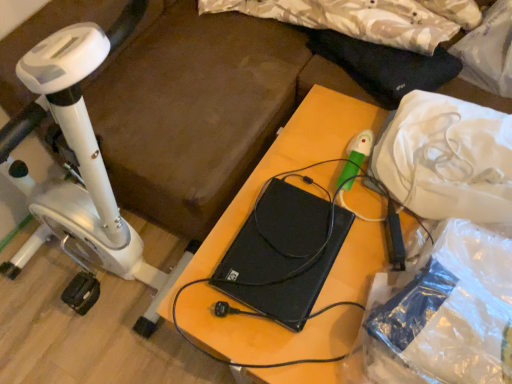
Locate an element on the screen. The width and height of the screenshot is (512, 384). free space behind black matte laptop at center is located at coordinates (292, 173).